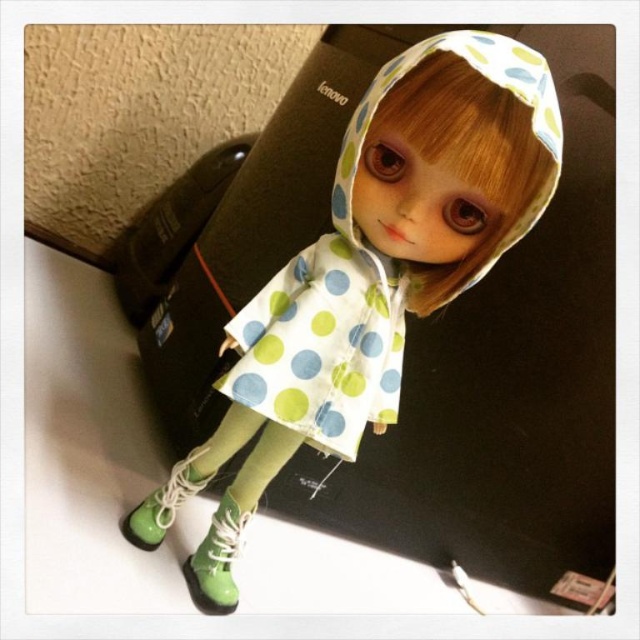
You are a photographer setting up a shot of the doll wearing the polka dot fabric dress at center. You want to place your camera so that it is exactly 36 inches away from the dress. Based on the current setup, is the camera positioned too close or too far from the dress?

The polka dot fabric dress at center and camera are 34.43 inches apart from each other. Since 34.43 inches is less than 36 inches, the camera is positioned too close to the dress.

You are a tailor trying to decide whether to use the white polka dot fabric at center to cover the green glossy boot at lower left. Based on their sizes, will the fabric be wide enough to cover the boot?

The white polka dot fabric at center might be wider than green glossy boot at lower left, so it could potentially cover the boot if the width is sufficient.